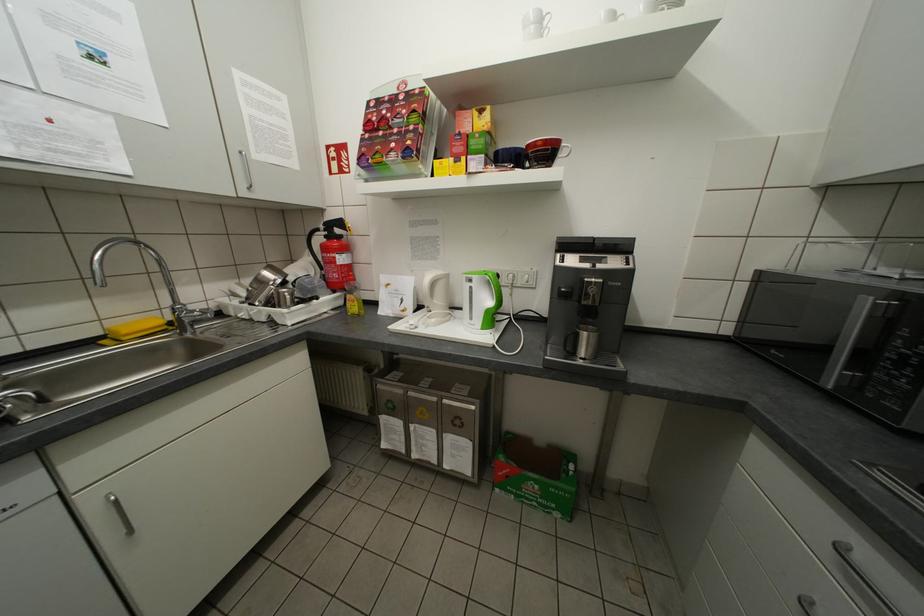
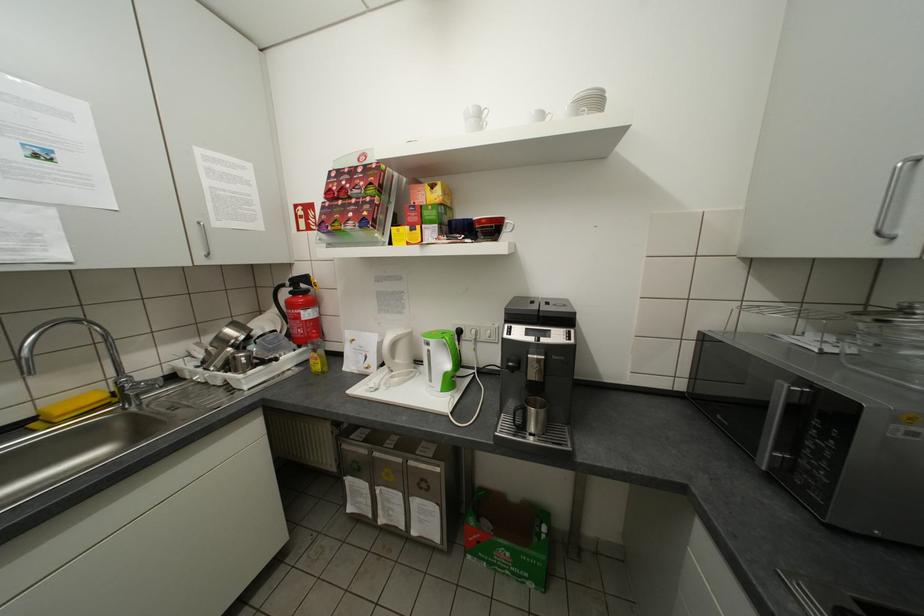
Where in the second image is the point corresponding to (442,321) from the first image?

(406, 379)